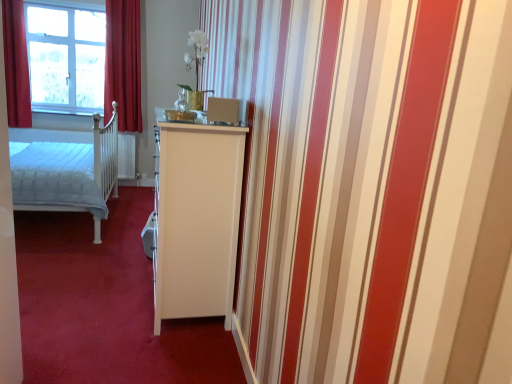
Question: In terms of height, does white glossy cabinet at center look taller or shorter compared to velvet red curtain at upper left, which ranks as the first curtain in right-to-left order?

Choices:
 (A) short
 (B) tall

Answer: (A)

Question: Is white glossy cabinet at center situated inside velvet red curtain at upper left, the second curtain positioned from the left, or outside?

Choices:
 (A) outside
 (B) inside

Answer: (A)

Question: Estimate the real-world distances between objects in this image. Which object is closer to the white quilted fabric bed at left?

Choices:
 (A) clear glass window at upper left
 (B) red velvet curtain at left, marked as the first curtain in a left-to-right arrangement
 (C) velvet red curtain at upper left, the second curtain positioned from the left
 (D) white glossy cabinet at center

Answer: (B)

Question: Which object is the closest to the white quilted fabric bed at left?

Choices:
 (A) velvet red curtain at upper left, which ranks as the first curtain in right-to-left order
 (B) red velvet curtain at left, which appears as the second curtain when viewed from the right
 (C) clear glass window at upper left
 (D) white glossy cabinet at center

Answer: (B)